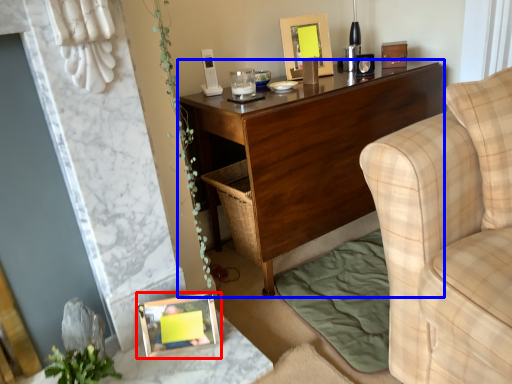
Question: Which object is further to the camera taking this photo, picture frame (highlighted by a red box) or desk (highlighted by a blue box)?

Choices:
 (A) picture frame
 (B) desk

Answer: (B)